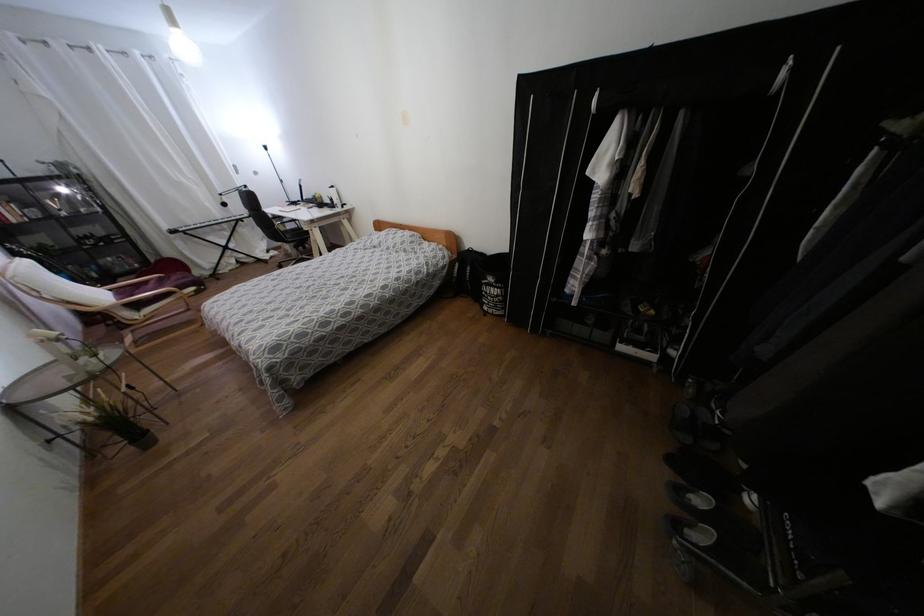
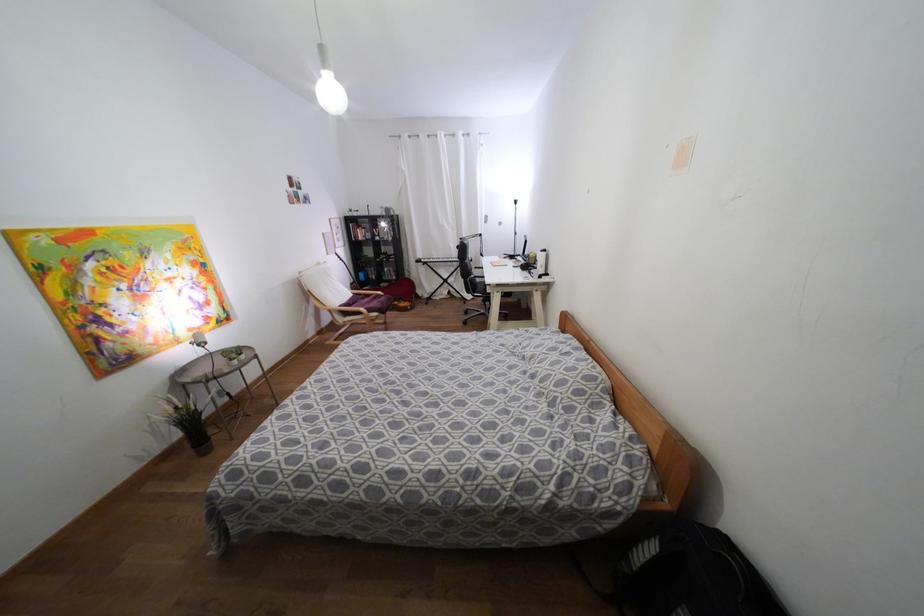
The point at (x=137, y=306) is marked in the first image. Where is the corresponding point in the second image?

(344, 313)